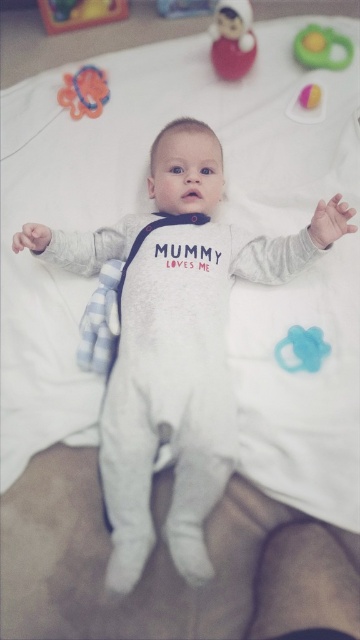
A baby is lying on a white blanket. There are two toys near the baby. The coordinates of the first toy are point A at (77, 93). The coordinates of the second toy are point B at 0.356, 0.489. The baby wants to reach one of the toys first. Which toy is closer to the baby?

The distance between point A at (77, 93) and point B at 0.356, 0.489 is 4.98 feet. Therefore, the baby is closer to point A at (77, 93).